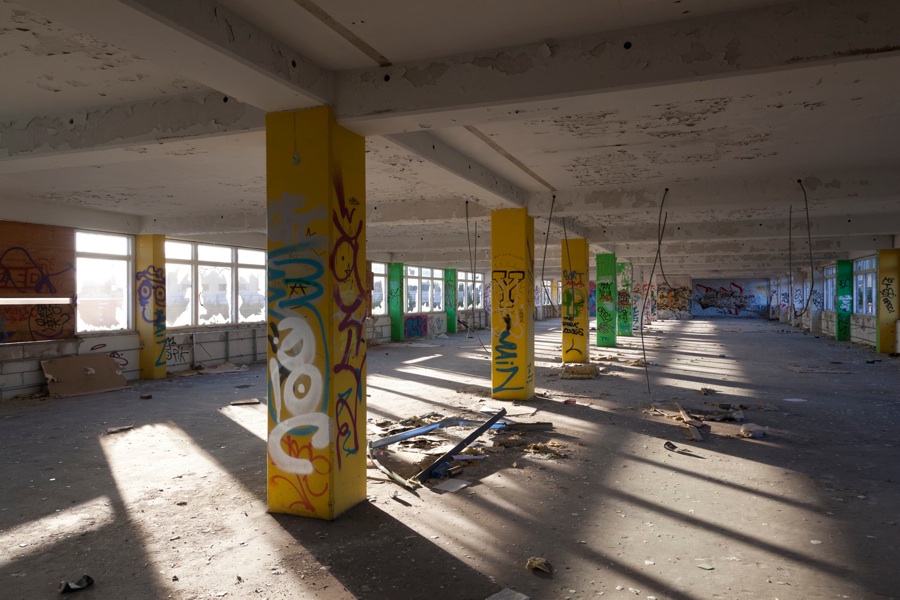
This screenshot has height=600, width=900. In order to click on windows on the right in this screenshot , I will do `click(868, 286)`, `click(851, 290)`.